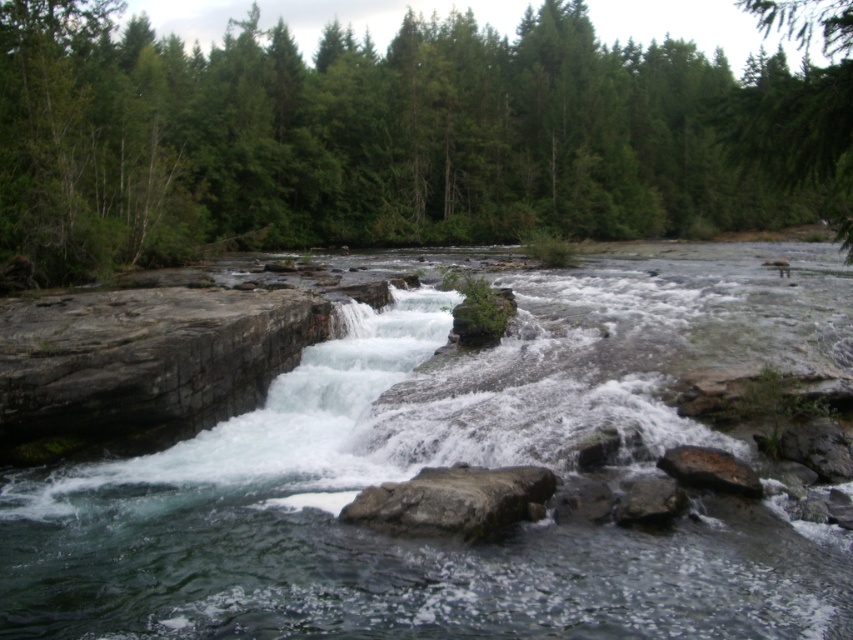
You are a hiker trying to cross the river using the rocks. You see the gray rough rock at center and the smooth gray rock at lower center. Which rock should you step on first to start your crossing?

You should step on the smooth gray rock at lower center first because it is positioned below the gray rough rock at center, making it the lower starting point for crossing.

You are a hiker trying to cross the river. You see the clear stone river at center and the smooth gray rock at lower right. Which path would allow you to cross the river more easily?

The smooth gray rock at lower right is a better path to cross the river more easily because it is smaller in width compared to the clear stone river at center.